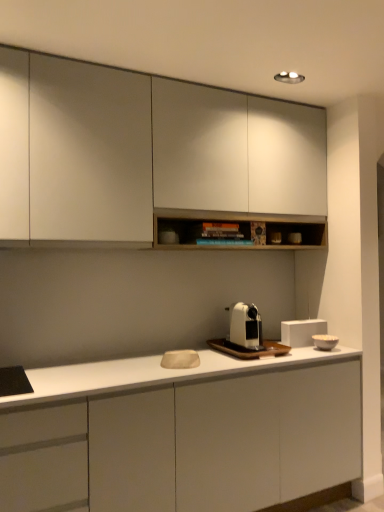
Question: Does white matte cabinet at center, marked as the 1th cabinetry in a bottom-to-top arrangement, have a larger size compared to matte white cabinet at upper center, which is counted as the first cabinetry, starting from the top?

Choices:
 (A) yes
 (B) no

Answer: (A)

Question: Does white matte cabinet at center, which appears as the second cabinetry when viewed from the top, have a lesser height compared to matte white cabinet at upper center, which is the 2th cabinetry in bottom-to-top order?

Choices:
 (A) yes
 (B) no

Answer: (A)

Question: Is white matte cabinet at center, which appears as the second cabinetry when viewed from the top, turned away from matte white cabinet at upper center, which is counted as the first cabinetry, starting from the top?

Choices:
 (A) yes
 (B) no

Answer: (B)

Question: Considering the relative positions of white matte cabinet at center, which appears as the second cabinetry when viewed from the top, and matte white cabinet at upper center, which is the 2th cabinetry in bottom-to-top order, in the image provided, is white matte cabinet at center, which appears as the second cabinetry when viewed from the top, in front of matte white cabinet at upper center, which is the 2th cabinetry in bottom-to-top order,?

Choices:
 (A) no
 (B) yes

Answer: (B)

Question: From a real-world perspective, does white matte cabinet at center, which appears as the second cabinetry when viewed from the top, stand above matte white cabinet at upper center, which is counted as the first cabinetry, starting from the top?

Choices:
 (A) no
 (B) yes

Answer: (A)

Question: Relative to white matte cabinet at center, which appears as the second cabinetry when viewed from the top, is white matte coffee machine at center in front or behind?

Choices:
 (A) behind
 (B) front

Answer: (A)

Question: From a real-world perspective, is white matte coffee machine at center physically located above or below white matte cabinet at center, marked as the 1th cabinetry in a bottom-to-top arrangement?

Choices:
 (A) above
 (B) below

Answer: (A)

Question: Is white matte coffee machine at center wider or thinner than white matte cabinet at center, marked as the 1th cabinetry in a bottom-to-top arrangement?

Choices:
 (A) thin
 (B) wide

Answer: (A)

Question: Choose the correct answer: Is white matte coffee machine at center inside white matte cabinet at center, marked as the 1th cabinetry in a bottom-to-top arrangement, or outside it?

Choices:
 (A) outside
 (B) inside

Answer: (A)

Question: Is white matte bowl at right, positioned as the first appliance in front-to-back order, wider or thinner than white matte cabinet at center, which appears as the second cabinetry when viewed from the top?

Choices:
 (A) wide
 (B) thin

Answer: (B)

Question: Do you think white matte bowl at right, placed as the 2th appliance when sorted from back to front, is within white matte cabinet at center, which appears as the second cabinetry when viewed from the top, or outside of it?

Choices:
 (A) inside
 (B) outside

Answer: (A)

Question: Is white matte bowl at right, placed as the 2th appliance when sorted from back to front, bigger or smaller than white matte cabinet at center, which appears as the second cabinetry when viewed from the top?

Choices:
 (A) small
 (B) big

Answer: (A)

Question: In the image, is white matte bowl at right, positioned as the first appliance in front-to-back order, positioned in front of or behind white matte cabinet at center, which appears as the second cabinetry when viewed from the top?

Choices:
 (A) front
 (B) behind

Answer: (B)

Question: From the image's perspective, is matte white cabinet at upper center, which is the 2th cabinetry in bottom-to-top order, positioned above or below white matte cabinet at center, marked as the 1th cabinetry in a bottom-to-top arrangement?

Choices:
 (A) below
 (B) above

Answer: (B)

Question: Is point (125, 166) positioned closer to the camera than point (109, 415)?

Choices:
 (A) farther
 (B) closer

Answer: (A)